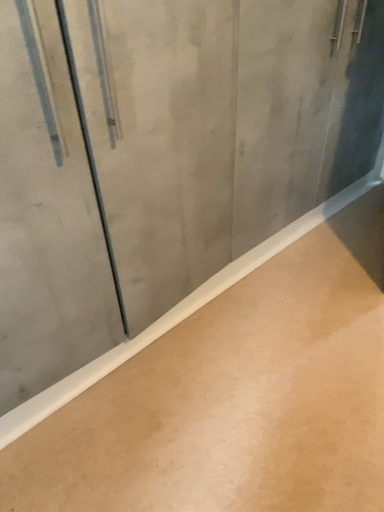
Image resolution: width=384 pixels, height=512 pixels. What do you see at coordinates (236, 397) in the screenshot?
I see `smooth concrete at center` at bounding box center [236, 397].

The height and width of the screenshot is (512, 384). Find the location of `smooth concrete at center`. smooth concrete at center is located at coordinates (236, 397).

I want to click on smooth concrete at center, so click(236, 397).